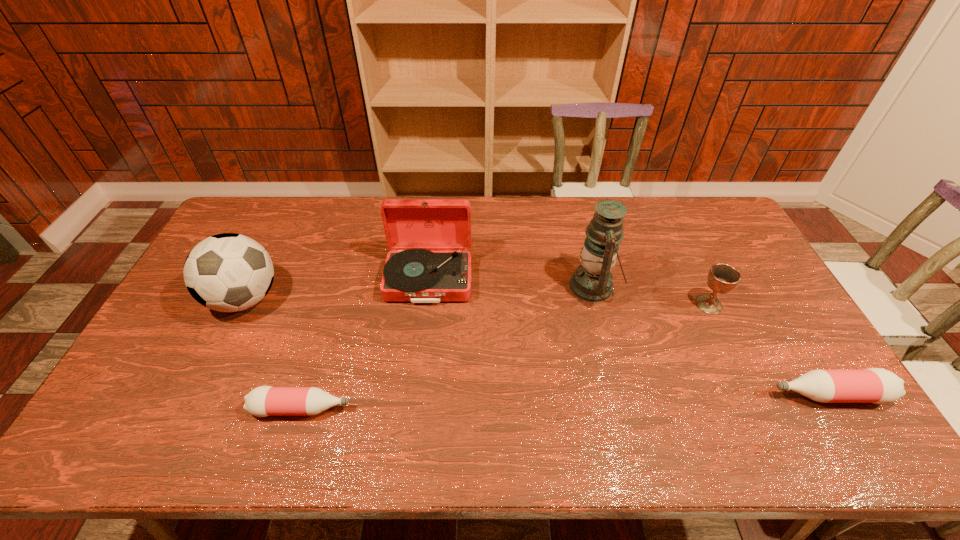
This screenshot has width=960, height=540. In order to click on object positioned at the near right corner in this screenshot , I will do `click(873, 385)`.

In order to click on free location at the far edge of the desktop in this screenshot , I will do `click(479, 218)`.

Locate an element on the screen. vacant space at the near edge is located at coordinates (547, 400).

You are a GUI agent. You are given a task and a screenshot of the screen. Output one action in this format:
    pyautogui.click(x=<x>, y=<y>)
    Task: Click on the free space at the right edge of the desktop
    
    Given the screenshot: What is the action you would take?
    pyautogui.click(x=773, y=376)

Where is `free space at the far left corner of the desktop`? This screenshot has height=540, width=960. free space at the far left corner of the desktop is located at coordinates (244, 204).

Locate an element on the screen. free space between the leftmost object and the right bottle is located at coordinates (537, 347).

Identify the location of unoccupied area between the tallest object and the fifth object from left to right. (651, 295).

Find the location of a particular element. This screenshot has height=540, width=960. free space between the third object from right to left and the phonograph_record is located at coordinates (512, 283).

Where is `vacant space that's between the rightmost object and the leftmost object`? The width and height of the screenshot is (960, 540). vacant space that's between the rightmost object and the leftmost object is located at coordinates (537, 347).

Identify the location of free space that is in between the shortest object and the leftmost object. (274, 354).